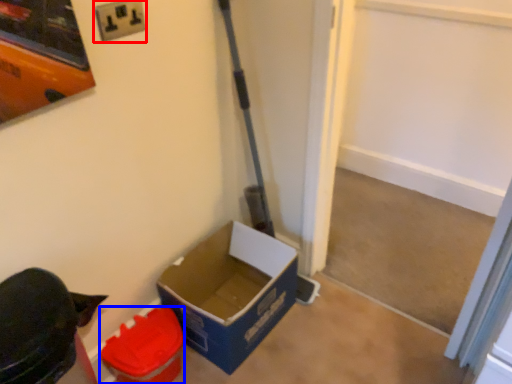
Question: Which object appears farthest to the camera in this image, electric outlet (highlighted by a red box) or box (highlighted by a blue box)?

Choices:
 (A) electric outlet
 (B) box

Answer: (B)